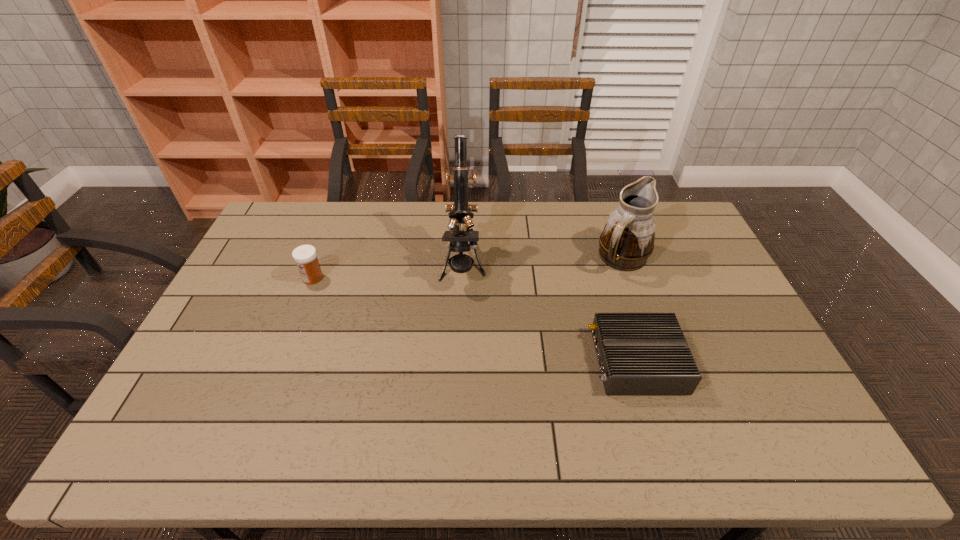
Identify the location of free spot at the far right corner of the desktop. The image size is (960, 540). point(680,204).

This screenshot has width=960, height=540. Find the location of `unoccupied position between the pitcher and the shortest object`. unoccupied position between the pitcher and the shortest object is located at coordinates (630, 309).

Locate an element on the screen. empty space that is in between the third shortest object and the microscope is located at coordinates (542, 261).

Where is `vacant point located between the router and the third object from right to left`? vacant point located between the router and the third object from right to left is located at coordinates (550, 313).

You are a GUI agent. You are given a task and a screenshot of the screen. Output one action in this format:
    pyautogui.click(x=<x>, y=<y>)
    Task: Click on the vacant area that lies between the third shortest object and the third object from right to left
    The height and width of the screenshot is (540, 960).
    Given the screenshot: What is the action you would take?
    coord(542,261)

In order to click on empty location between the medicine and the tallest object in this screenshot , I will do `click(388, 271)`.

Identify the location of vacant region between the tallest object and the third tallest object. Image resolution: width=960 pixels, height=540 pixels. (388, 271).

Find the location of `free space between the nearest object and the second shortest object`. free space between the nearest object and the second shortest object is located at coordinates (475, 319).

The width and height of the screenshot is (960, 540). In order to click on free area in between the third shortest object and the router in this screenshot , I will do `click(630, 309)`.

You are a GUI agent. You are given a task and a screenshot of the screen. Output one action in this format:
    pyautogui.click(x=<x>, y=<y>)
    Task: Click on the unoccupied area between the third object from right to left and the medicine
    Image resolution: width=960 pixels, height=540 pixels.
    Given the screenshot: What is the action you would take?
    pyautogui.click(x=388, y=271)